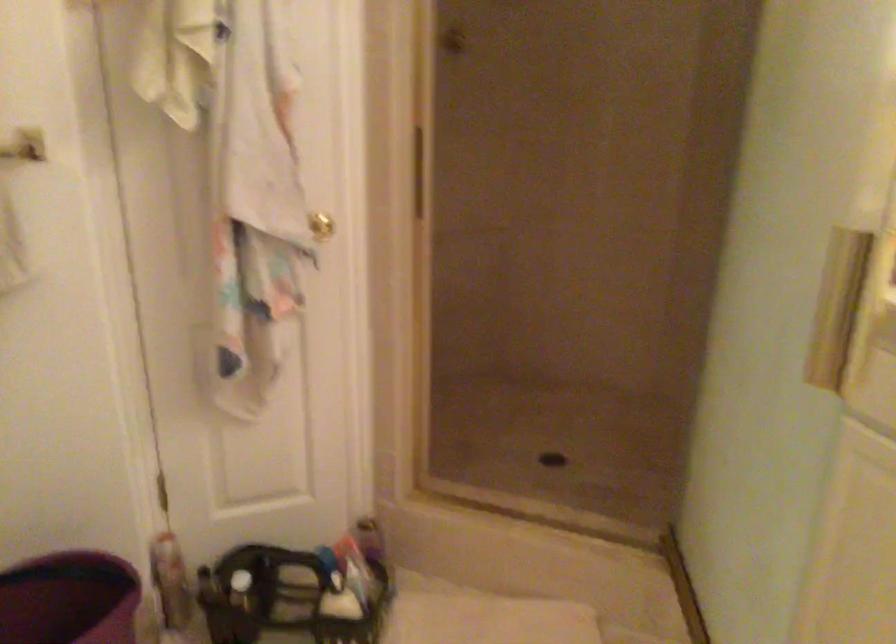
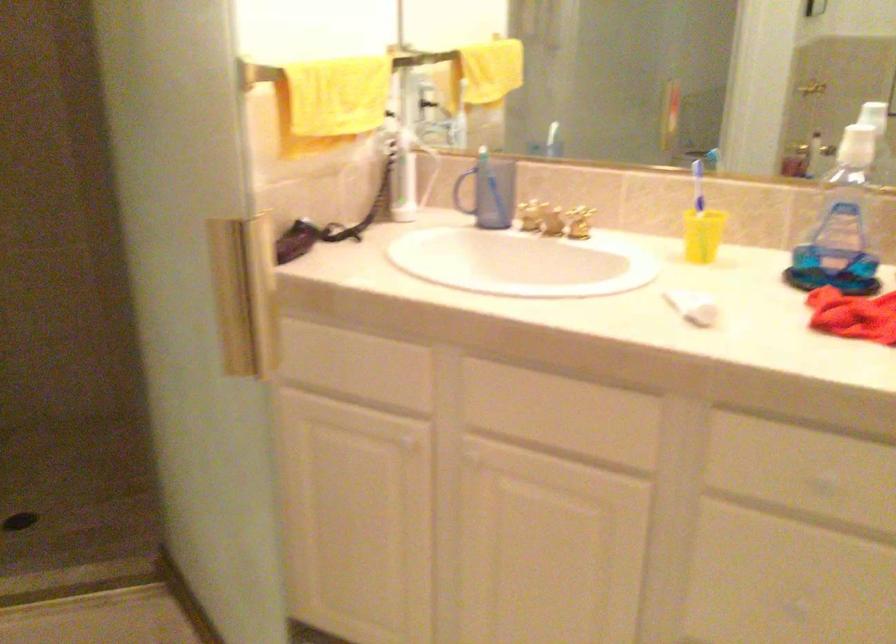
Question: The images are taken continuously from a first-person perspective. In which direction is your viewpoint rotating?

Choices:
 (A) Left
 (B) Right
 (C) Up
 (D) Down

Answer: (B)